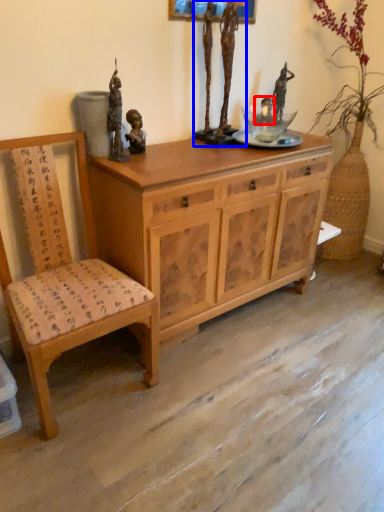
Question: Among these objects, which one is nearest to the camera, person (highlighted by a red box) or sculpture (highlighted by a blue box)?

Choices:
 (A) person
 (B) sculpture

Answer: (B)